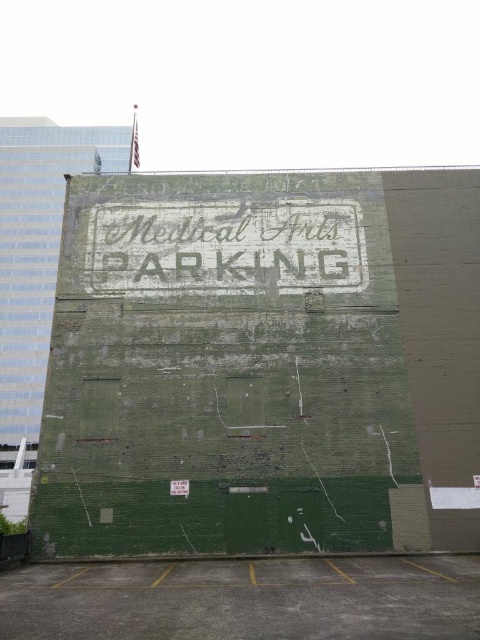
Between gray concrete parking lot at lower center and white distressed sign at center, which one is positioned lower?

gray concrete parking lot at lower center is lower down.

Does point (237, 566) come in front of point (97, 284)?

Yes, point (237, 566) is in front of point (97, 284).

Who is more forward, (342, 602) or (134, 221)?

Positioned in front is point (342, 602).

You are a GUI agent. You are given a task and a screenshot of the screen. Output one action in this format:
    pyautogui.click(x=<x>, y=<y>)
    Task: Click on the gray concrete parking lot at lower center
    This screenshot has width=480, height=640.
    Given the screenshot: What is the action you would take?
    pyautogui.click(x=245, y=600)